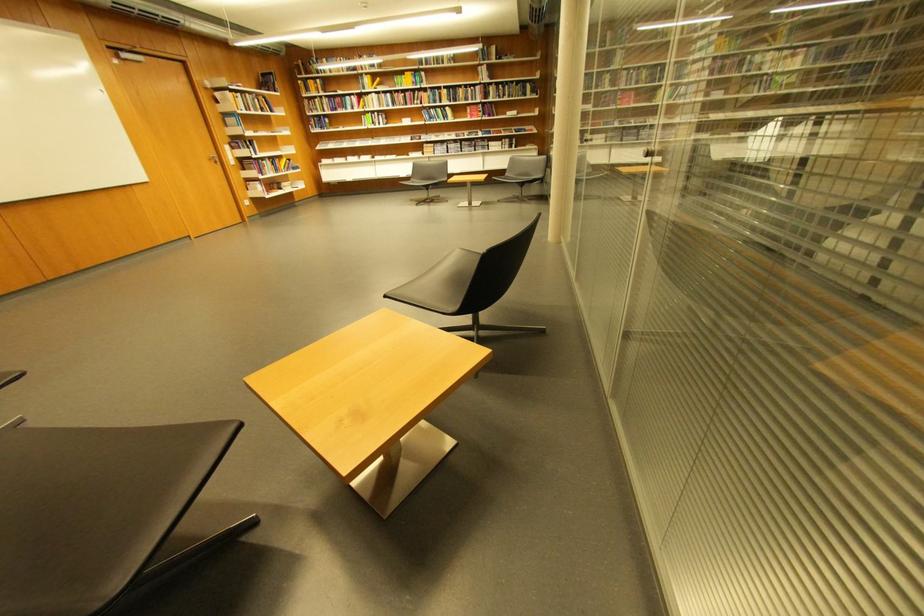
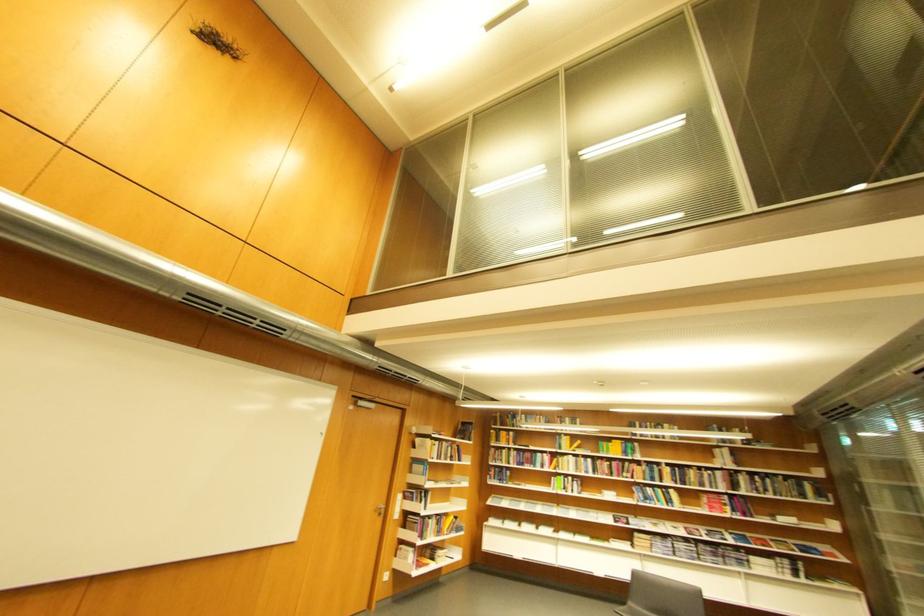
In the second image, find the point that corresponds to point 362,110 in the first image.

(553, 468)